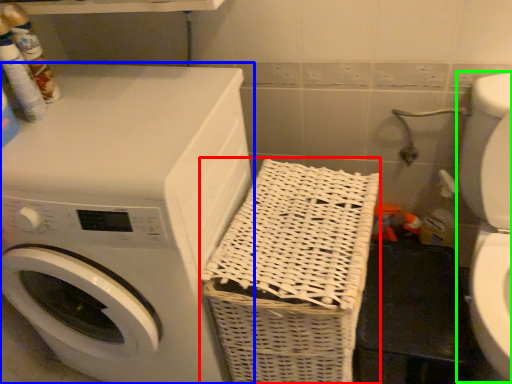
Question: Which object is the closest to the basket (highlighted by a red box)? Choose among these: washing machine (highlighted by a blue box) or washer (highlighted by a green box).

Choices:
 (A) washing machine
 (B) washer

Answer: (A)